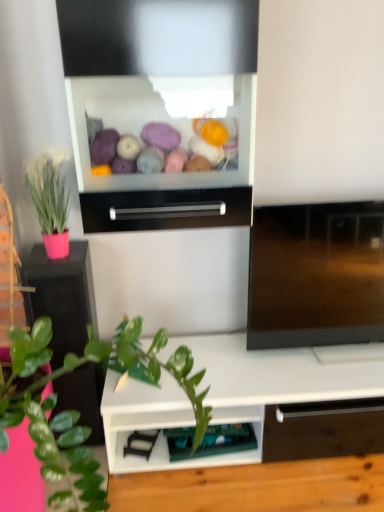
Identify the location of empty space that is ontop of pink matte plant pot at left (from a real-world perspective). The height and width of the screenshot is (512, 384). (60, 258).